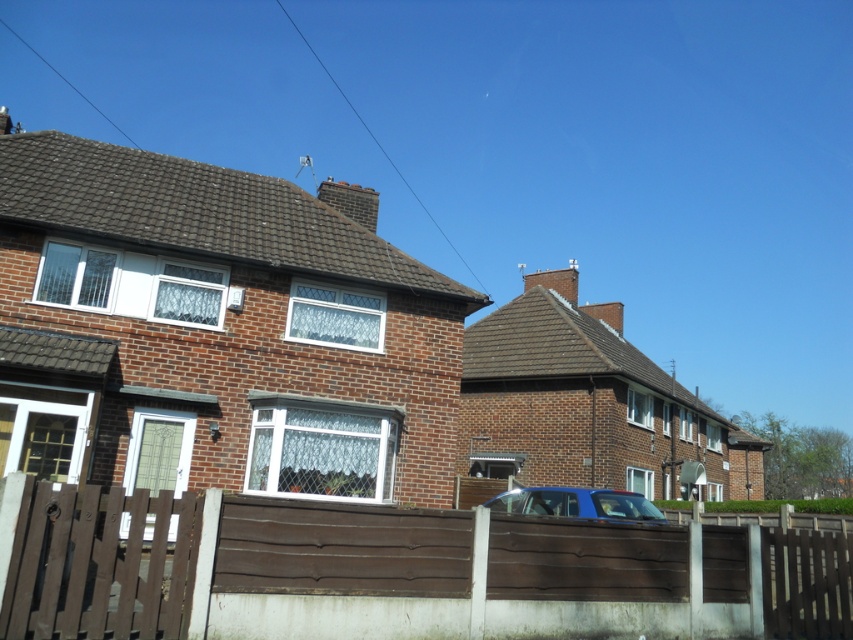
Between brown wooden fence at center and blue matte car at center, which one is positioned lower?

blue matte car at center is below.

Can you confirm if brown wooden fence at center is positioned below blue matte car at center?

No.

The height and width of the screenshot is (640, 853). What do you see at coordinates (395, 572) in the screenshot?
I see `brown wooden fence at center` at bounding box center [395, 572].

Where is `brown wooden fence at center`? The image size is (853, 640). brown wooden fence at center is located at coordinates (395, 572).